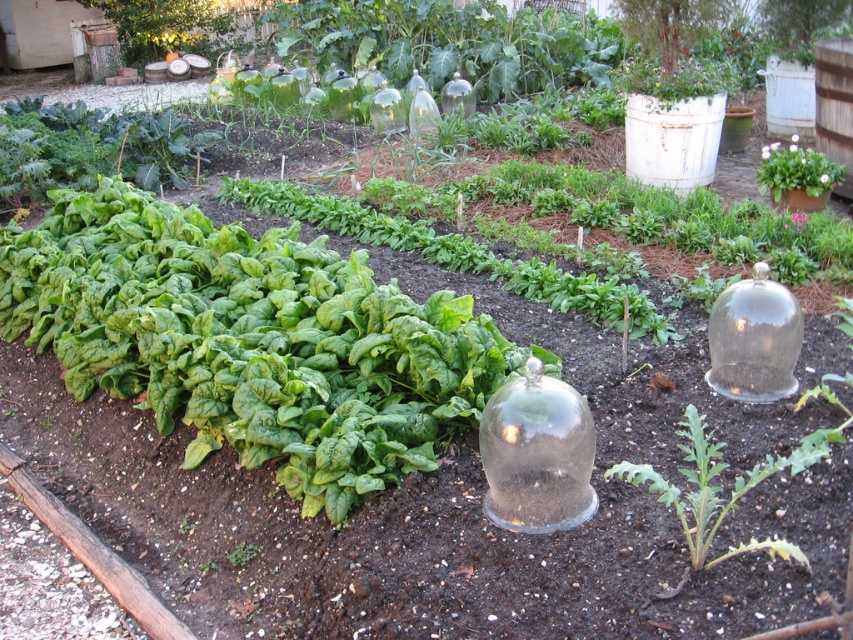
You are a gardener inspecting the garden bed. You notice two points marked in the image. The first point is at coordinate point (149, 292) and the second is at point (781, 557). Which point is closer to your viewpoint?

Point (149, 292) is closer to your viewpoint because it is further to the camera than point (781, 557).